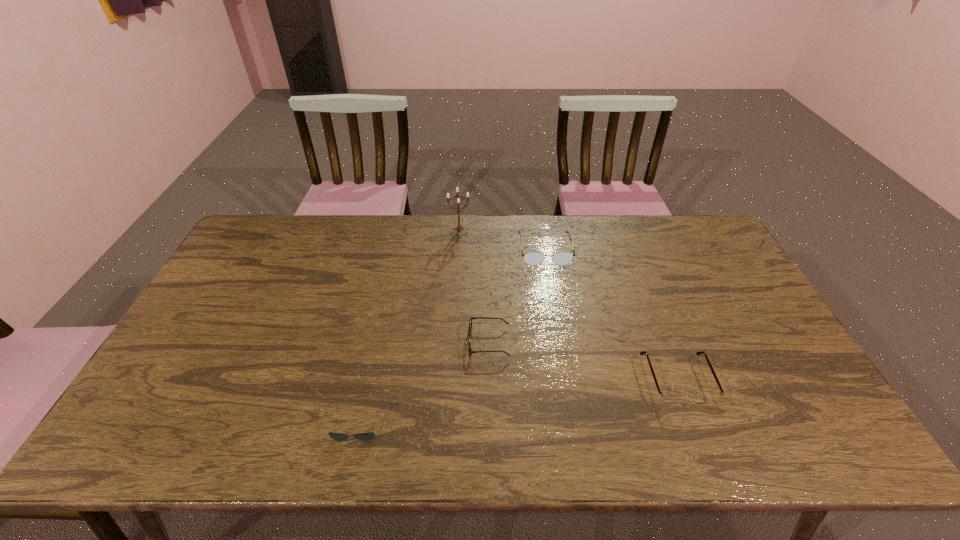
Where is `candle holder`? Image resolution: width=960 pixels, height=540 pixels. candle holder is located at coordinates (459, 228).

Find the location of a particular element. Image resolution: width=960 pixels, height=540 pixels. the second object from right to left is located at coordinates (532, 258).

The width and height of the screenshot is (960, 540). In order to click on the second spectacles from right to left in this screenshot , I will do `click(532, 258)`.

I want to click on the rightmost object, so click(x=666, y=398).

Locate an element on the screen. This screenshot has width=960, height=540. the shortest spectacles is located at coordinates (470, 322).

Where is `the leftmost object`? The width and height of the screenshot is (960, 540). the leftmost object is located at coordinates (368, 436).

Locate an element on the screen. This screenshot has height=540, width=960. free space located 0.110m on the right of the candle holder is located at coordinates (502, 233).

Where is `vacant region located 0.110m on the lenses of the second spectacles from right to left`? vacant region located 0.110m on the lenses of the second spectacles from right to left is located at coordinates (552, 289).

In order to click on vacant space located 0.080m at the hinge ends of the rightmost object in this screenshot , I will do `click(700, 439)`.

Image resolution: width=960 pixels, height=540 pixels. I want to click on vacant space located 0.060m on the front-facing side of the shortest spectacles, so click(x=446, y=342).